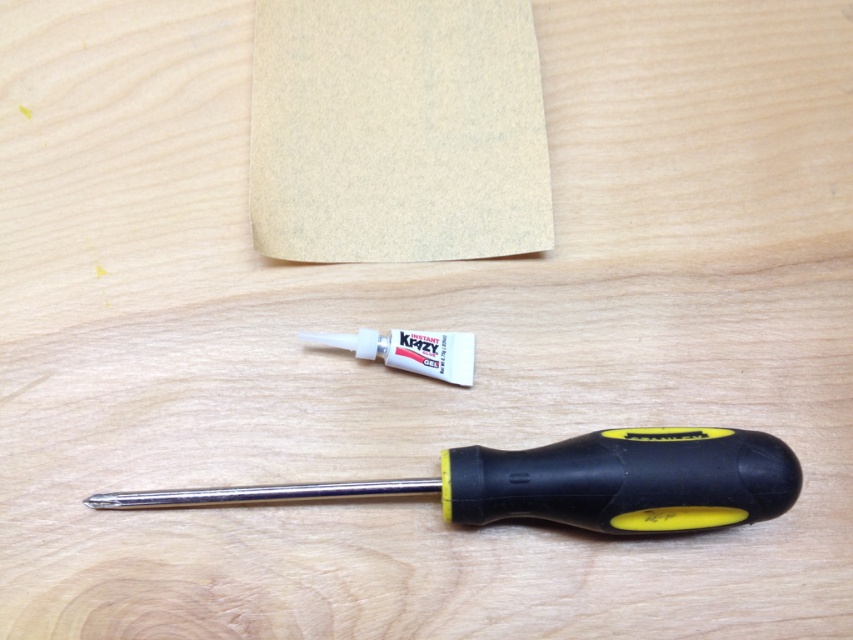
You are looking at a wooden table with two points marked on it. From your perspective, which point is closer to you, point (399, 129) or point (757, 499)?

Point (399, 129) is closer to you than point (757, 499) because it is further to the camera.